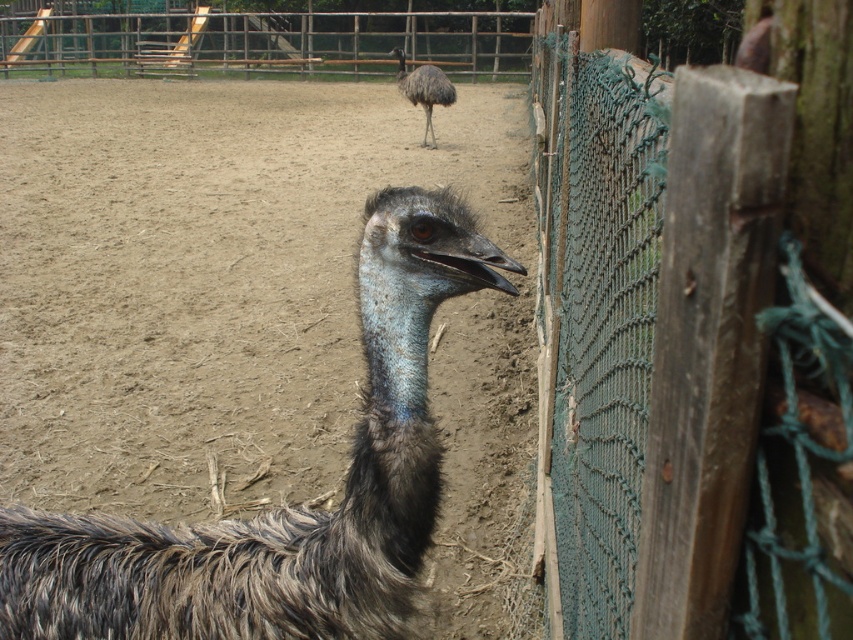
You are a photographer standing at the camera position. You want to take a photo of the emu in the foreground without the green mesh fence at right appearing in the shot. Is it possible to do so by moving the camera closer to the emu?

The green mesh fence at right and camera are 15.46 inches apart from each other. Moving the camera closer to the emu would decrease the distance between the camera and the fence, making it more likely the fence would appear in the photo. Therefore, it is not possible to avoid the green mesh fence at right by moving closer.

You are a zookeeper observing an enclosure with a dark brown feathered ostrich at center and dark brown feathers at upper center. Which object is wider?

The dark brown feathered ostrich at center is wider than the dark brown feathers at upper center.

You are a zookeeper trying to identify the larger object between the dark brown feathered ostrich at center and the dark brown feathers at upper center. Which one is bigger?

The dark brown feathered ostrich at center is bigger than the dark brown feathers at upper center.